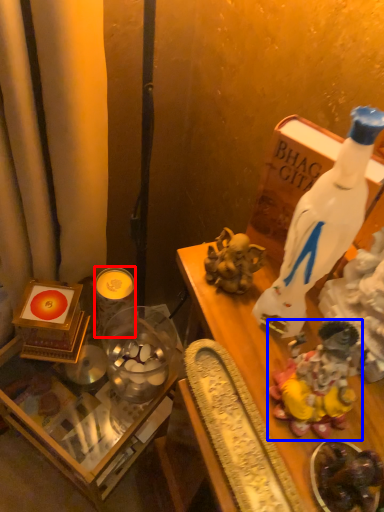
Question: Which object appears closest to the camera in this image, candle (highlighted by a red box) or toy (highlighted by a blue box)?

Choices:
 (A) candle
 (B) toy

Answer: (B)